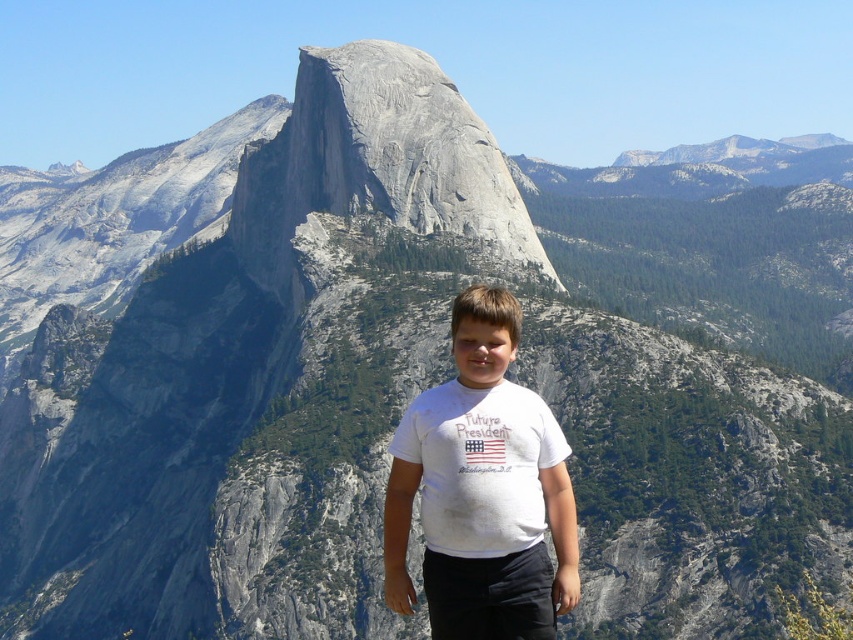
Question: Can you confirm if white cotton shirt at center is positioned above gray rock formation at center?

Choices:
 (A) yes
 (B) no

Answer: (B)

Question: Which point is farther from the camera taking this photo?

Choices:
 (A) (294, 150)
 (B) (457, 307)

Answer: (A)

Question: Among these objects, which one is farthest from the camera?

Choices:
 (A) white cotton shirt at center
 (B) gray rock formation at center

Answer: (B)

Question: Can you confirm if white cotton shirt at center is positioned below gray rock formation at center?

Choices:
 (A) yes
 (B) no

Answer: (A)

Question: Is white cotton shirt at center closer to camera compared to gray rock formation at center?

Choices:
 (A) yes
 (B) no

Answer: (A)